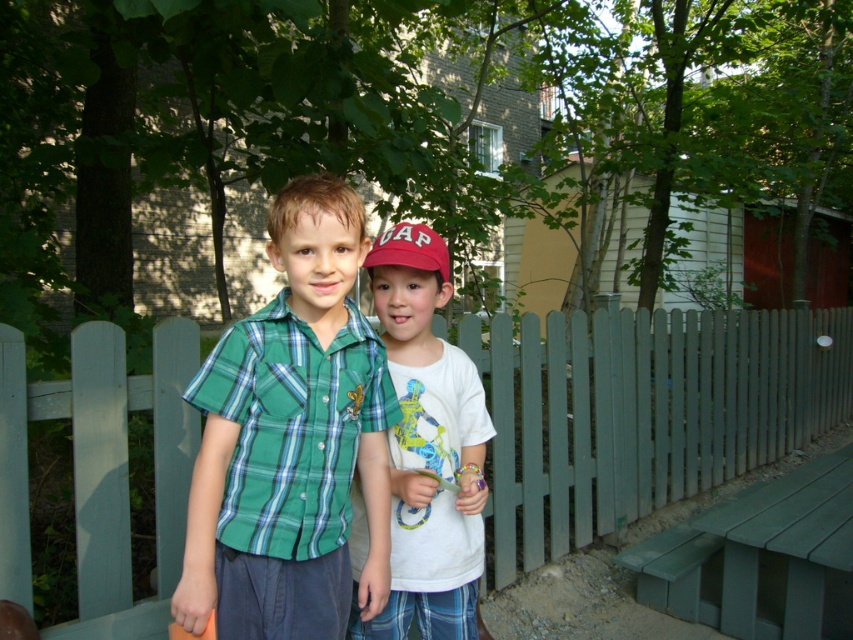
In the scene shown: Between green plaid shirt at center and matte red baseball cap at center, which one appears on the left side from the viewer's perspective?

green plaid shirt at center

Is green plaid shirt at center positioned at the back of matte red baseball cap at center?

That is False.

Is point (309, 387) closer to viewer compared to point (422, 268)?

Yes, point (309, 387) is closer to viewer.

At what (x,y) coordinates should I click in order to perform the action: click on green plaid shirt at center. Please return your answer as a coordinate pair (x, y). The width and height of the screenshot is (853, 640). Looking at the image, I should click on (291, 440).

Is the position of green wooden fence at center more distant than that of white matte t-shirt at center?

That is True.

Consider the image. How far apart are green wooden fence at center and white matte t-shirt at center?

green wooden fence at center is 5.13 feet away from white matte t-shirt at center.

Is point (780, 323) positioned after point (355, 637)?

Yes, it is.

Find the location of a particular element. Image resolution: width=853 pixels, height=640 pixels. green wooden fence at center is located at coordinates (642, 412).

Is green plaid shirt at center shorter than green painted wood park bench at lower right?

No, green plaid shirt at center is not shorter than green painted wood park bench at lower right.

How distant is green plaid shirt at center from green painted wood park bench at lower right?

green plaid shirt at center is 2.50 meters from green painted wood park bench at lower right.

Who is more forward, [314,608] or [845,525]?

Point [314,608] is in front.

Where is `green plaid shirt at center`? This screenshot has width=853, height=640. green plaid shirt at center is located at coordinates (291, 440).